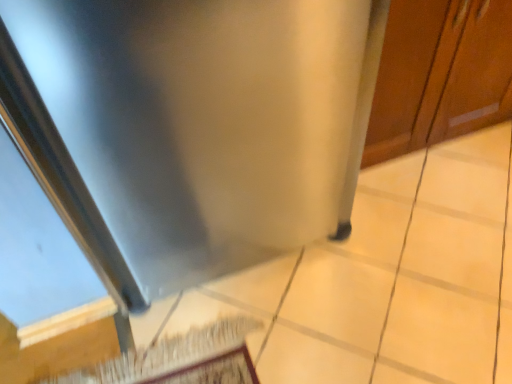
This screenshot has height=384, width=512. In order to click on stainless steel at lower right in this screenshot , I will do `click(206, 122)`.

What do you see at coordinates (206, 122) in the screenshot? I see `stainless steel at lower right` at bounding box center [206, 122].

Describe the element at coordinates (440, 74) in the screenshot. This screenshot has width=512, height=384. I see `stainless steel refrigerator at center` at that location.

Locate an element on the screen. stainless steel refrigerator at center is located at coordinates (440, 74).

Measure the distance between stainless steel refrigerator at center and camera.

stainless steel refrigerator at center is 1.14 meters from camera.

This screenshot has height=384, width=512. Identify the location of stainless steel at lower right. [206, 122].

Considering the relative positions of stainless steel at lower right and stainless steel refrigerator at center in the image provided, is stainless steel at lower right to the right of stainless steel refrigerator at center from the viewer's perspective?

In fact, stainless steel at lower right is to the left of stainless steel refrigerator at center.

Considering the positions of objects stainless steel at lower right and stainless steel refrigerator at center in the image provided, who is in front, stainless steel at lower right or stainless steel refrigerator at center?

stainless steel at lower right is more forward.

Which is behind, point (253, 40) or point (422, 54)?

The point (422, 54) is behind.

From the image's perspective, would you say stainless steel at lower right is shown under stainless steel refrigerator at center?

Correct, stainless steel at lower right appears lower than stainless steel refrigerator at center in the image.

From a real-world perspective, is stainless steel at lower right positioned over stainless steel refrigerator at center based on gravity?

Yes.

In terms of width, does stainless steel at lower right look wider or thinner when compared to stainless steel refrigerator at center?

stainless steel at lower right is wider than stainless steel refrigerator at center.

Can you confirm if stainless steel at lower right is taller than stainless steel refrigerator at center?

Yes.

Considering the sizes of objects stainless steel at lower right and stainless steel refrigerator at center in the image provided, who is bigger, stainless steel at lower right or stainless steel refrigerator at center?

stainless steel at lower right is bigger.

Is stainless steel at lower right completely or partially outside of stainless steel refrigerator at center?

Yes, stainless steel at lower right is located beyond the bounds of stainless steel refrigerator at center.

Is stainless steel at lower right in contact with stainless steel refrigerator at center?

No, stainless steel at lower right is not beside stainless steel refrigerator at center.

From the picture: Could you tell me if stainless steel at lower right is turned towards stainless steel refrigerator at center?

No, stainless steel at lower right is not aimed at stainless steel refrigerator at center.

Looking at this image, how many degrees apart are the facing directions of stainless steel at lower right and stainless steel refrigerator at center?

The angular difference between stainless steel at lower right and stainless steel refrigerator at center is 0.947 degrees.

How far apart are stainless steel at lower right and stainless steel refrigerator at center?

The distance of stainless steel at lower right from stainless steel refrigerator at center is 22.69 inches.

This screenshot has height=384, width=512. Identify the location of stainless steel below the stainless steel refrigerator at center (from the image's perspective). (206, 122).

In the scene shown: Does stainless steel refrigerator at center appear on the left side of stainless steel at lower right?

No, stainless steel refrigerator at center is not to the left of stainless steel at lower right.

In the image, is stainless steel refrigerator at center positioned in front of or behind stainless steel at lower right?

Clearly, stainless steel refrigerator at center is behind stainless steel at lower right.

Between point (484, 115) and point (291, 175), which one is positioned in front?

The point (291, 175) is more forward.

From the image's perspective, who appears lower, stainless steel refrigerator at center or stainless steel at lower right?

stainless steel at lower right appears lower in the image.

From a real-world perspective, which is physically above, stainless steel refrigerator at center or stainless steel at lower right?

In real-world perspective, stainless steel at lower right is above.

Based on the photo, in terms of width, does stainless steel refrigerator at center look wider or thinner when compared to stainless steel at lower right?

Clearly, stainless steel refrigerator at center has less width compared to stainless steel at lower right.

From the picture: Who is taller, stainless steel refrigerator at center or stainless steel at lower right?

stainless steel at lower right.

Which of these two, stainless steel refrigerator at center or stainless steel at lower right, is smaller?

stainless steel refrigerator at center.

Is stainless steel refrigerator at center situated inside stainless steel at lower right or outside?

stainless steel refrigerator at center is spatially situated outside stainless steel at lower right.

Is stainless steel refrigerator at center far away from stainless steel at lower right?

No.

Is stainless steel refrigerator at center oriented away from stainless steel at lower right?

stainless steel refrigerator at center does not have its back to stainless steel at lower right.

Locate an element on the screen. The height and width of the screenshot is (384, 512). stainless steel on the left of stainless steel refrigerator at center is located at coordinates (206, 122).

Identify the location of stainless steel above the stainless steel refrigerator at center (from a real-world perspective). This screenshot has height=384, width=512. (206, 122).

Find the location of a particular element. This screenshot has height=384, width=512. door below the stainless steel at lower right (from a real-world perspective) is located at coordinates (440, 74).